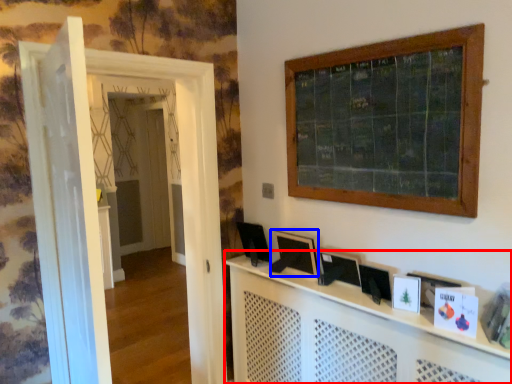
Question: Which object appears farthest to the camera in this image, computer desk (highlighted by a red box) or picture frame (highlighted by a blue box)?

Choices:
 (A) computer desk
 (B) picture frame

Answer: (B)